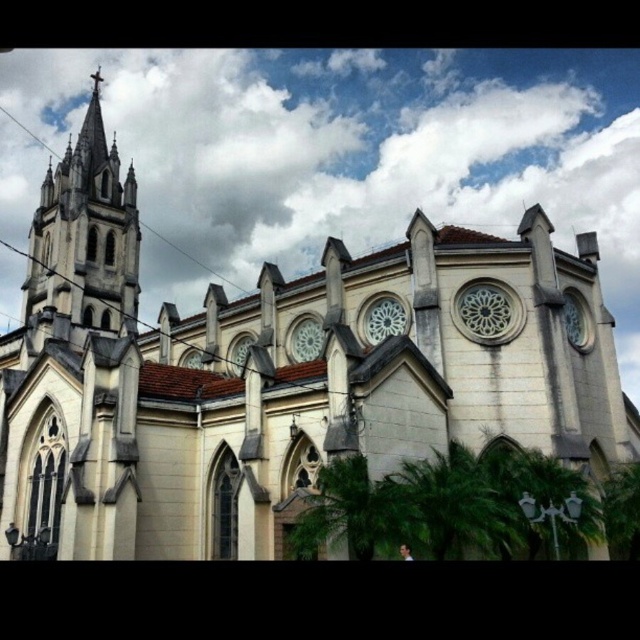
You are standing in front of the Gothic church and notice two points marked on the facade. The first point is at coordinates point (99, 180) and the second is at point (563, 472). Which point is closer to you?

Point (99, 180) is further to the camera than point (563, 472). Therefore, point (563, 472) is closer to you.

You are standing in front of the Gothic church and want to take a photo of the green leafy palm at lower center. Where should you position yourself to capture it in the frame?

The green leafy palm at lower center is located at point (449,506), so you should position yourself directly in front of it to capture it in the frame.